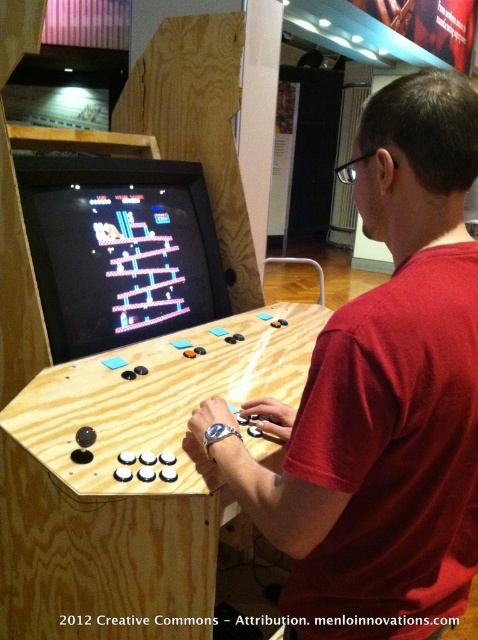
You are trying to determine if the matte wood man at center can be placed on top of the wooden arcade cabinet at center. Based on the height difference between them, is this possible?

The matte wood man at center is much taller than the wooden arcade cabinet at center, so placing it on top would not be stable or possible due to the height difference.

Consider the image. Where is the matte wood man at center located in the coordinate system?

The matte wood man at center is located at point coordinates of 0.619 on the x axis and 0.799 on the y axis.

Looking at this image, you are standing in front of the arcade console and want to reach the point at coordinates point (249,509). If your arm can extend 28 inches, can you comfortably reach that point without moving your feet?

The distance between you and the point (249,509) is 31.48 inches. Since your arm can only extend 28 inches, you cannot comfortably reach it without moving your feet.